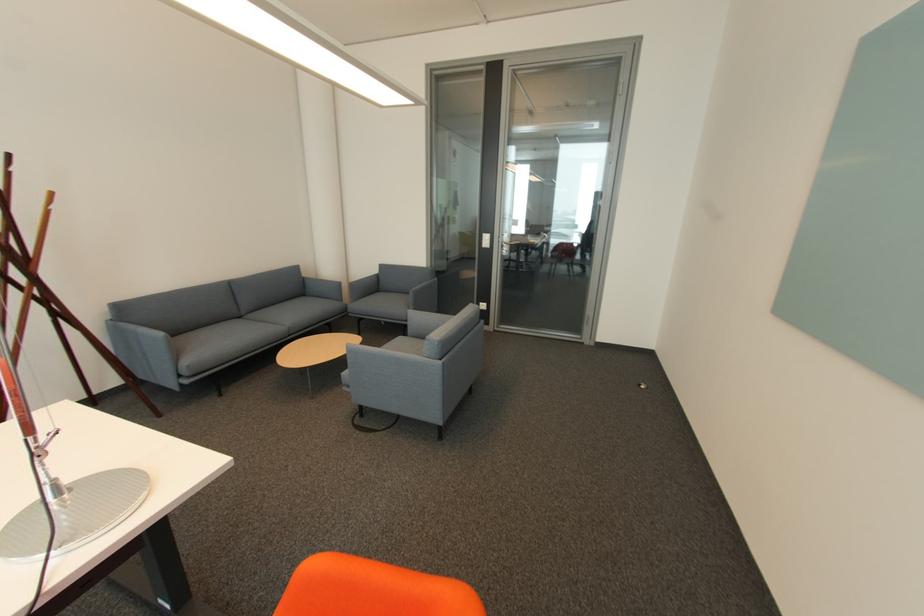
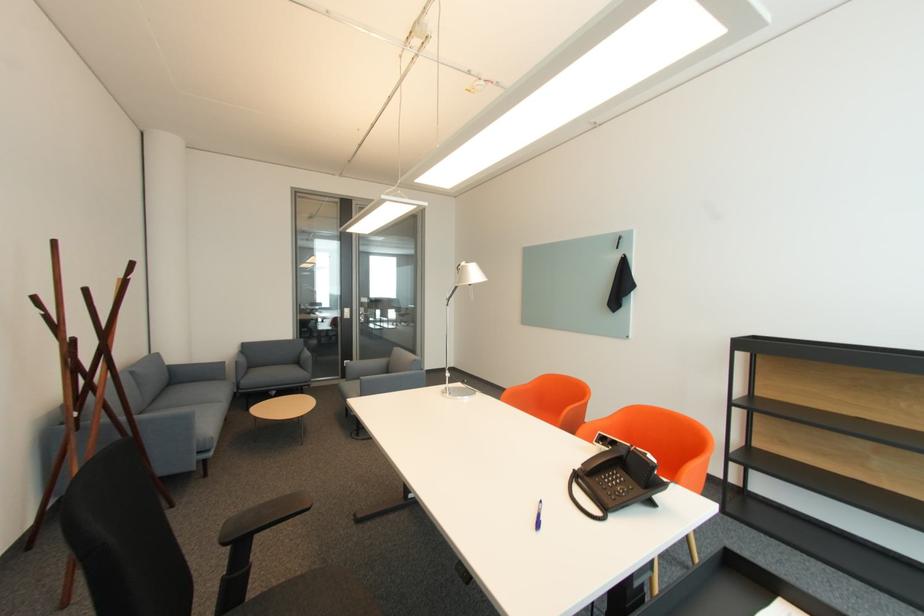
In the second image, find the point that corresponds to point (249, 315) in the first image.

(151, 411)